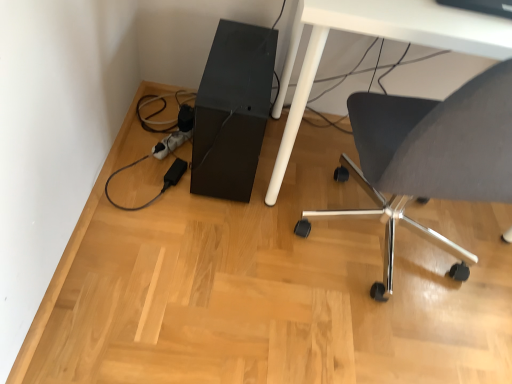
The height and width of the screenshot is (384, 512). I want to click on free spot to the left of matte gray chair at lower right, so click(216, 266).